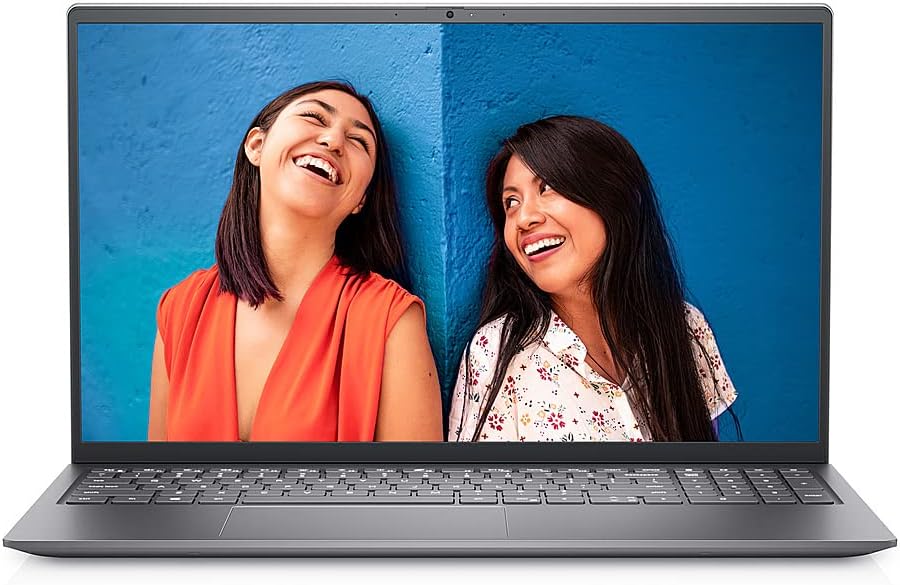
This screenshot has width=900, height=585. In order to click on right wall in this screenshot , I will do [655, 106].